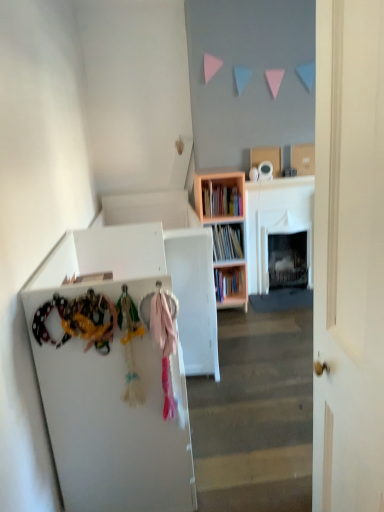
Question: Is wooden bookshelf at center positioned beyond the bounds of pink wood bookcase at center?

Choices:
 (A) no
 (B) yes

Answer: (A)

Question: Is the depth of wooden bookshelf at center greater than that of pink wood bookcase at center?

Choices:
 (A) no
 (B) yes

Answer: (B)

Question: From the image's perspective, is wooden bookshelf at center beneath pink wood bookcase at center?

Choices:
 (A) yes
 (B) no

Answer: (B)

Question: Does wooden bookshelf at center appear on the left side of pink wood bookcase at center?

Choices:
 (A) no
 (B) yes

Answer: (B)

Question: Is wooden bookshelf at center far from pink wood bookcase at center?

Choices:
 (A) no
 (B) yes

Answer: (A)

Question: From the image's perspective, is wooden bookshelf at center over pink wood bookcase at center?

Choices:
 (A) yes
 (B) no

Answer: (A)

Question: Considering the relative sizes of pink wood bookcase at center and white matte cabinet at left in the image provided, is pink wood bookcase at center wider than white matte cabinet at left?

Choices:
 (A) yes
 (B) no

Answer: (B)

Question: From the image's perspective, would you say pink wood bookcase at center is shown under white matte cabinet at left?

Choices:
 (A) no
 (B) yes

Answer: (A)

Question: Can you confirm if pink wood bookcase at center is positioned to the right of white matte cabinet at left?

Choices:
 (A) yes
 (B) no

Answer: (A)

Question: Does pink wood bookcase at center have a greater height compared to white matte cabinet at left?

Choices:
 (A) no
 (B) yes

Answer: (B)

Question: Is the position of pink wood bookcase at center more distant than that of white matte cabinet at left?

Choices:
 (A) no
 (B) yes

Answer: (B)

Question: Considering the relative sizes of pink wood bookcase at center and white matte cabinet at left in the image provided, is pink wood bookcase at center thinner than white matte cabinet at left?

Choices:
 (A) yes
 (B) no

Answer: (A)

Question: From the image's perspective, is pink wood bookcase at center on white matte door at center?

Choices:
 (A) yes
 (B) no

Answer: (A)